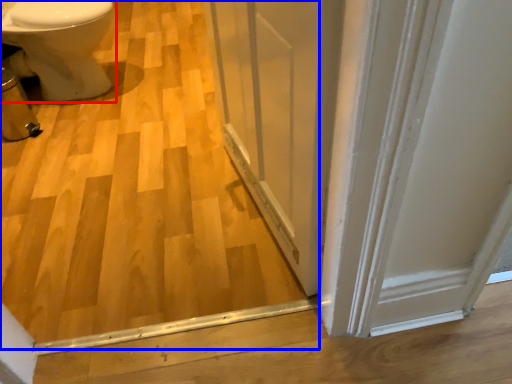
Question: Among these objects, which one is farthest to the camera, bidet (highlighted by a red box) or plywood (highlighted by a blue box)?

Choices:
 (A) bidet
 (B) plywood

Answer: (A)